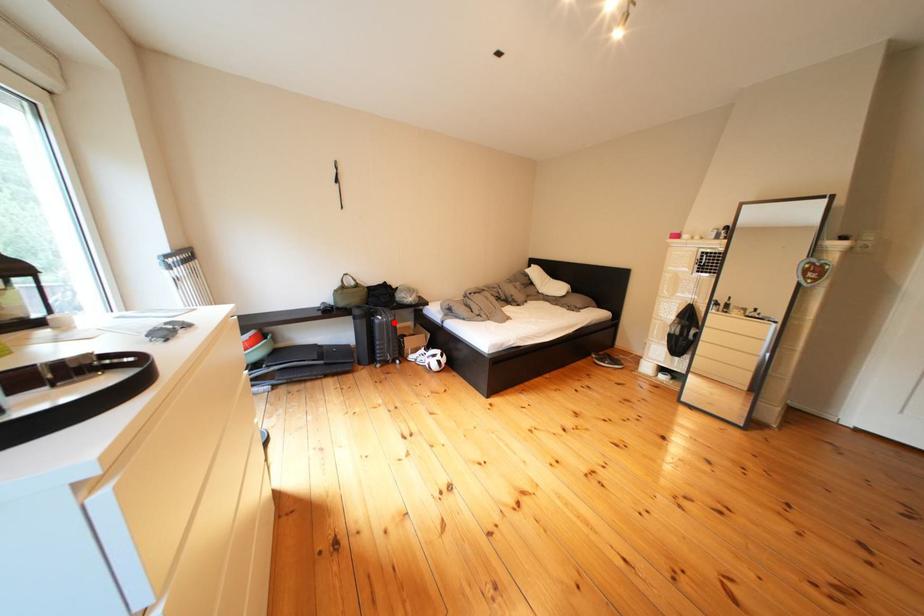
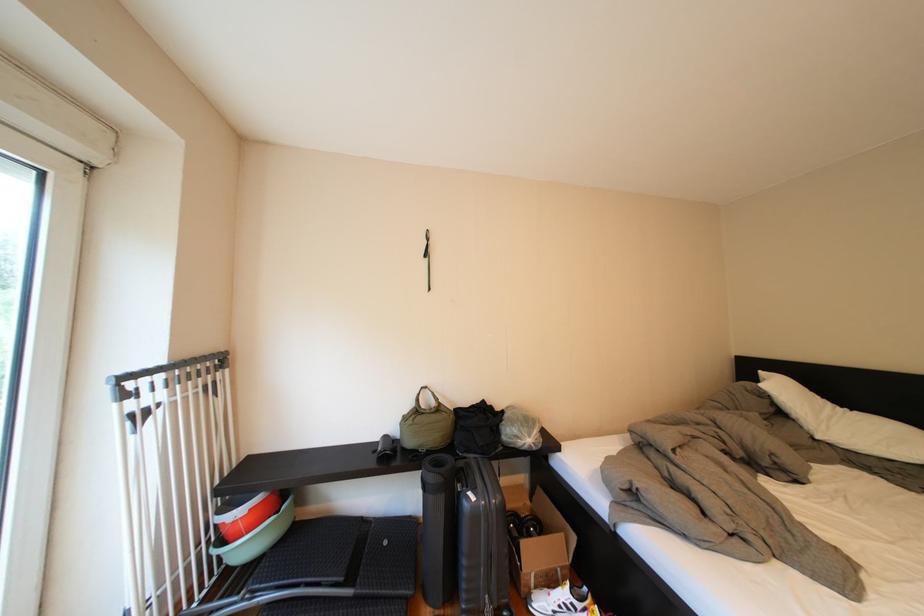
Question: A red point is marked in image1. In image2, is the corresponding 3D point closer to the camera or farther? Reply with the corresponding letter.

Choices:
 (A) The corresponding 3D point is closer.
 (B) The corresponding 3D point is farther.

Answer: (B)